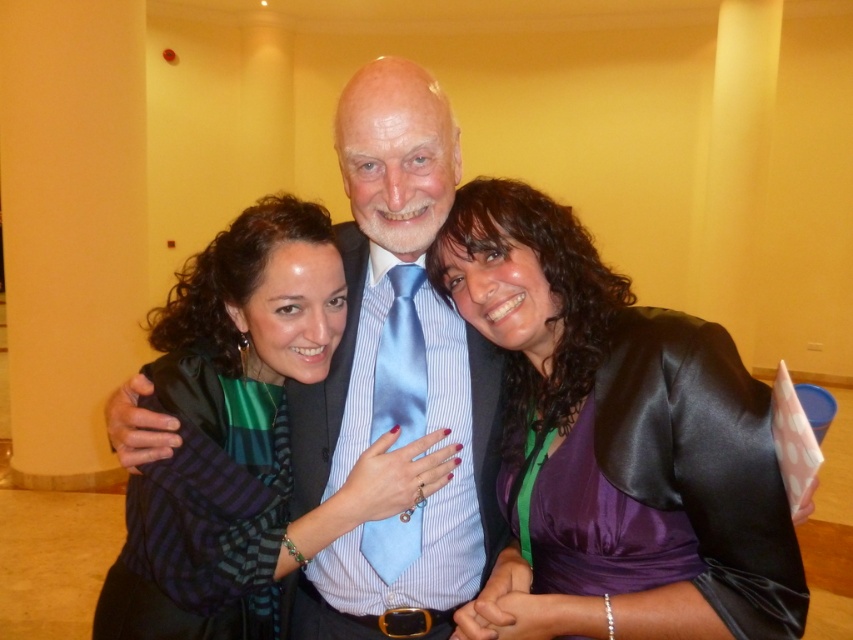
Question: Observing the image, what is the correct spatial positioning of satin purple dress at center in reference to blue satin tie at center?

Choices:
 (A) left
 (B) right

Answer: (B)

Question: Does satin purple dress at center appear over blue satin tie at center?

Choices:
 (A) no
 (B) yes

Answer: (A)

Question: Which point is closer to the camera?

Choices:
 (A) (480, 496)
 (B) (627, 449)

Answer: (B)

Question: Among these objects, which one is nearest to the camera?

Choices:
 (A) satin purple dress at center
 (B) blue satin tie at center

Answer: (A)

Question: Does satin purple dress at center have a larger size compared to blue satin tie at center?

Choices:
 (A) no
 (B) yes

Answer: (A)